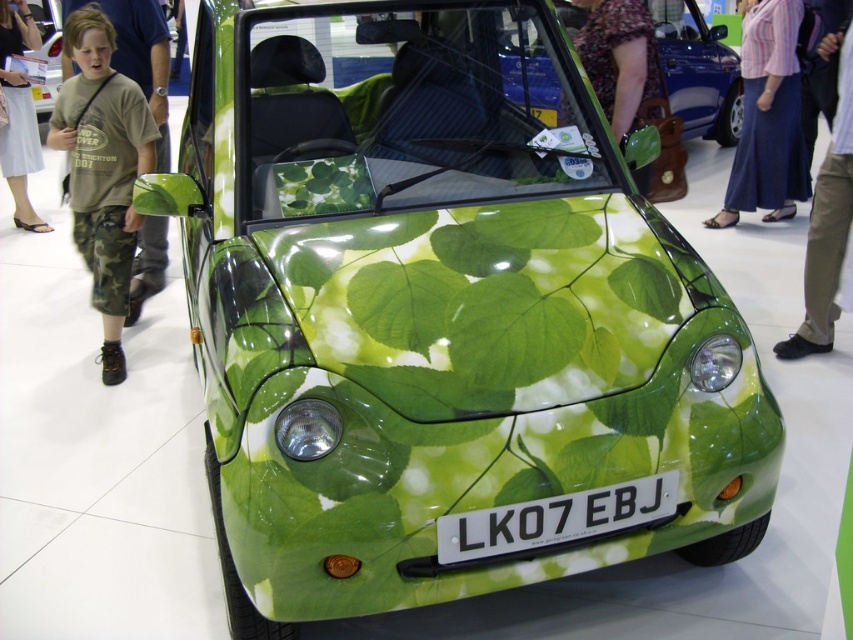
Question: Which point is closer to the camera?

Choices:
 (A) blue denim skirt at lower right
 (B) camouflage pants at left
 (C) tan leather shoes at lower right
 (D) green camo pants at left

Answer: (C)

Question: Among these objects, which one is nearest to the camera?

Choices:
 (A) green leafy wrap at center
 (B) tan leather shoes at lower right
 (C) blue denim skirt at lower right

Answer: (B)

Question: Among these points, which one is nearest to the camera?

Choices:
 (A) (828, 236)
 (B) (761, 29)
 (C) (544, 518)

Answer: (C)

Question: Can you confirm if green camo pants at left is thinner than blue denim skirt at lower right?

Choices:
 (A) yes
 (B) no

Answer: (A)

Question: In this image, where is green camo pants at left located relative to white plastic license plate at center?

Choices:
 (A) above
 (B) below

Answer: (A)

Question: Does white plastic license plate at center have a lesser width compared to camouflage pants at left?

Choices:
 (A) yes
 (B) no

Answer: (B)